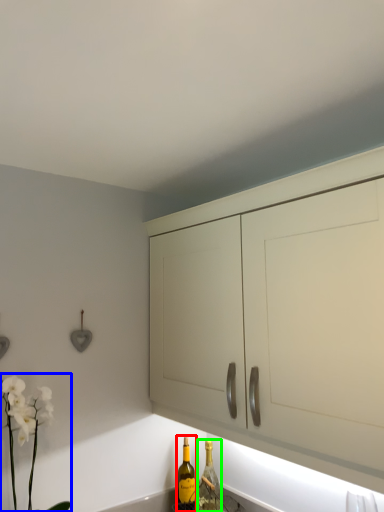
Question: Which object is positioned closest to bottle (highlighted by a red box)? Select from floral arrangement (highlighted by a blue box) and bottle (highlighted by a green box).

Choices:
 (A) floral arrangement
 (B) bottle

Answer: (B)